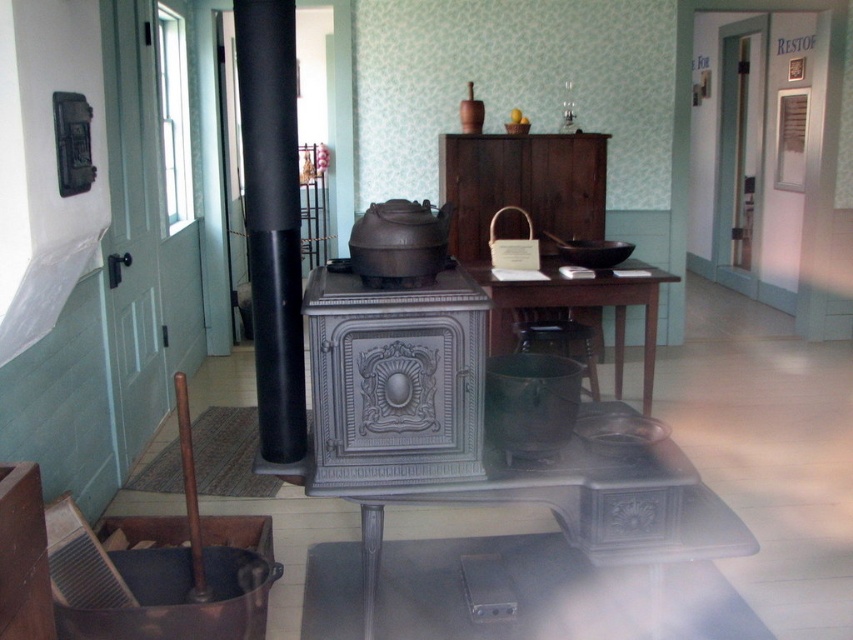
From the picture: Based on the coordinates provided, which object is located at point (395,381) in the vintage kitchen scene?

The metallic gray stove at center is located at point (395,381).

You are arranging a historical reenactment event in this vintage kitchen. You need to place a large serving platter that requires a sturdy surface. Which object between the dark wood table at center and the wooden stool at center would be more suitable for placing the platter?

The dark wood table at center has a larger size compared to the wooden stool at center, making it more suitable for placing the large serving platter due to its sturdier and larger surface area.